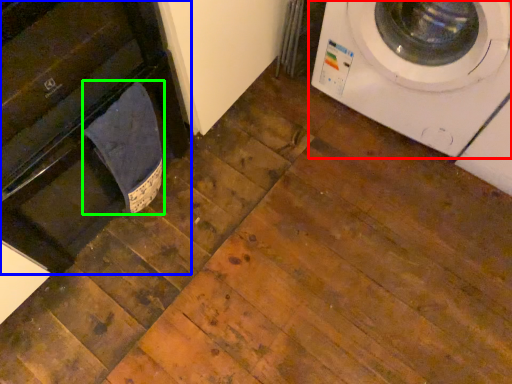
Question: Which object is the closest to the washing machine (highlighted by a red box)? Choose among these: dish washer (highlighted by a blue box) or laundry (highlighted by a green box).

Choices:
 (A) dish washer
 (B) laundry

Answer: (B)